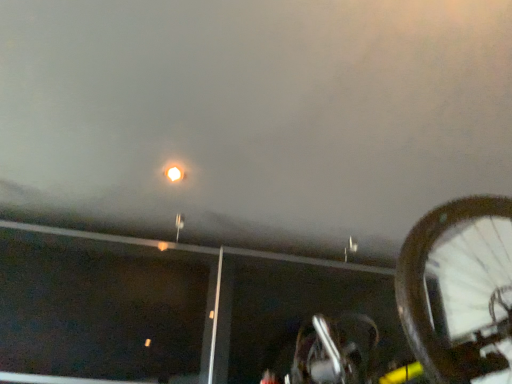
Question: Should I look upward or downward to see metallic silver street light at upper center?

Choices:
 (A) up
 (B) down

Answer: (B)

Question: Is metallic silver street light at upper center oriented away from shiny metallic bicycle at lower right?

Choices:
 (A) yes
 (B) no

Answer: (B)

Question: Would you say metallic silver street light at upper center is outside shiny metallic bicycle at lower right?

Choices:
 (A) no
 (B) yes

Answer: (B)

Question: Considering the relative positions of metallic silver street light at upper center and shiny metallic bicycle at lower right in the image provided, is metallic silver street light at upper center in front of shiny metallic bicycle at lower right?

Choices:
 (A) no
 (B) yes

Answer: (A)

Question: From the image's perspective, is metallic silver street light at upper center located beneath shiny metallic bicycle at lower right?

Choices:
 (A) no
 (B) yes

Answer: (A)

Question: From a real-world perspective, is metallic silver street light at upper center under shiny metallic bicycle at lower right?

Choices:
 (A) yes
 (B) no

Answer: (B)

Question: Is metallic silver street light at upper center further to camera compared to shiny metallic bicycle at lower right?

Choices:
 (A) yes
 (B) no

Answer: (A)

Question: Is shiny metallic bicycle at lower right bigger than metallic silver street light at upper center?

Choices:
 (A) yes
 (B) no

Answer: (A)

Question: From a real-world perspective, is shiny metallic bicycle at lower right physically below metallic silver street light at upper center?

Choices:
 (A) no
 (B) yes

Answer: (B)

Question: Does shiny metallic bicycle at lower right lie in front of metallic silver street light at upper center?

Choices:
 (A) yes
 (B) no

Answer: (A)

Question: Can you confirm if shiny metallic bicycle at lower right is wider than metallic silver street light at upper center?

Choices:
 (A) yes
 (B) no

Answer: (A)

Question: Is shiny metallic bicycle at lower right outside of metallic silver street light at upper center?

Choices:
 (A) no
 (B) yes

Answer: (B)

Question: Is shiny metallic bicycle at lower right at the right side of metallic silver street light at upper center?

Choices:
 (A) no
 (B) yes

Answer: (B)

Question: Choose the correct answer: Is shiny metallic bicycle at lower right inside metallic silver street light at upper center or outside it?

Choices:
 (A) inside
 (B) outside

Answer: (B)